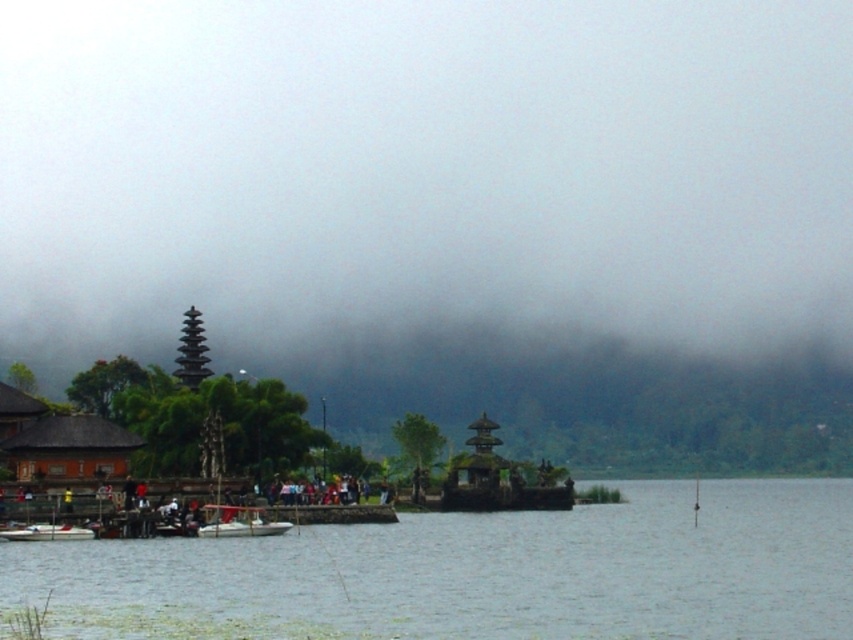
Consider the image. How far apart are white plastic boat at center and white plastic boat at lower left?

white plastic boat at center and white plastic boat at lower left are 9.26 meters apart.

Does white plastic boat at center have a lesser height compared to white plastic boat at lower left?

Incorrect, white plastic boat at center's height does not fall short of white plastic boat at lower left's.

Which is behind, point (286, 524) or point (36, 531)?

The point (286, 524) is more distant.

Locate an element on the screen. The height and width of the screenshot is (640, 853). white plastic boat at center is located at coordinates coord(239,522).

Can you confirm if foggy atmosphere at center is positioned below clear water at center?

Incorrect, foggy atmosphere at center is not positioned below clear water at center.

Between foggy atmosphere at center and clear water at center, which one is positioned higher?

foggy atmosphere at center

The image size is (853, 640). Describe the element at coordinates (451, 212) in the screenshot. I see `foggy atmosphere at center` at that location.

I want to click on foggy atmosphere at center, so click(451, 212).

Is foggy atmosphere at center below white plastic boat at center?

No, foggy atmosphere at center is not below white plastic boat at center.

The width and height of the screenshot is (853, 640). I want to click on foggy atmosphere at center, so click(x=451, y=212).

Where is `foggy atmosphere at center`? foggy atmosphere at center is located at coordinates (451, 212).